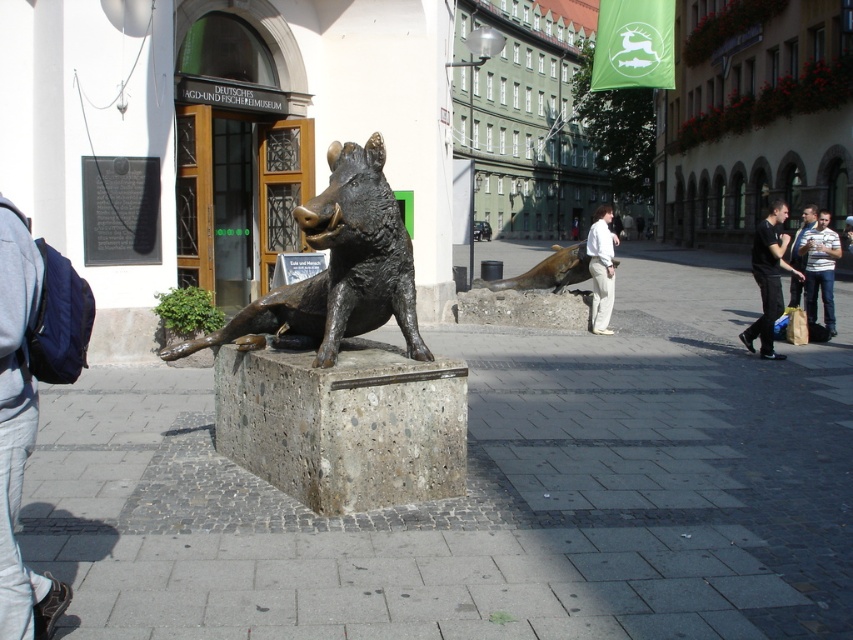
Question: Which object is positioned closest to the white shirt at center?

Choices:
 (A) bronze statue at center
 (B) striped shirt at center
 (C) black cotton shirt at right
 (D) bronze/statue at center

Answer: (A)

Question: Which is farther from the black cotton shirt at right?

Choices:
 (A) bronze/statue at center
 (B) white shirt at center
 (C) bronze statue at center

Answer: (A)

Question: Is bronze/statue at center bigger than striped shirt at center?

Choices:
 (A) yes
 (B) no

Answer: (A)

Question: Is black cotton shirt at right to the left of bronze statue at center from the viewer's perspective?

Choices:
 (A) no
 (B) yes

Answer: (A)

Question: In this image, where is bronze/statue at center located relative to bronze statue at center?

Choices:
 (A) left
 (B) right

Answer: (A)

Question: Considering the real-world distances, which object is closest to the black cotton shirt at right?

Choices:
 (A) striped shirt at center
 (B) white shirt at center

Answer: (A)